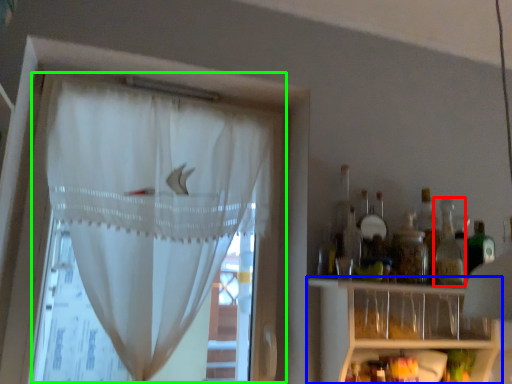
Question: Estimate the real-world distances between objects in this image. Which object is closer to bottle (highlighted by a red box), shelf (highlighted by a blue box) or curtain (highlighted by a green box)?

Choices:
 (A) shelf
 (B) curtain

Answer: (A)